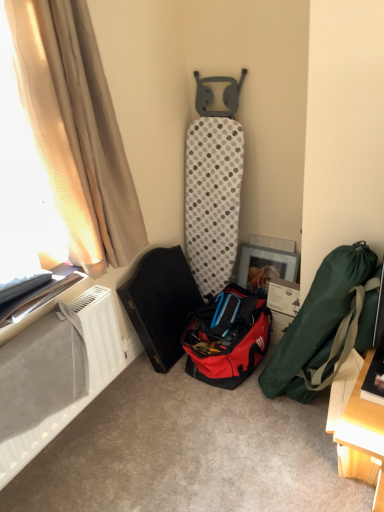
Question: From a real-world perspective, relative to white plastic radiator at lower left, is green fabric bag at right, which is the 2th luggage and bags from left to right, vertically above or below?

Choices:
 (A) below
 (B) above

Answer: (A)

Question: Is green fabric bag at right, the 1th luggage and bags when ordered from right to left, situated inside white plastic radiator at lower left or outside?

Choices:
 (A) inside
 (B) outside

Answer: (B)

Question: Considering the real-world distances, which object is closest to the beige fabric curtain at left?

Choices:
 (A) green fabric bag at right, the 1th luggage and bags when ordered from right to left
 (B) red fabric bag at center, the 1th luggage and bags in the left-to-right sequence
 (C) translucent beige curtain at left
 (D) white plastic radiator at lower left

Answer: (C)

Question: Considering the real-world distances, which object is farthest from the green fabric bag at right, the 1th luggage and bags when ordered from right to left?

Choices:
 (A) red fabric bag at center, the 1th luggage and bags in the left-to-right sequence
 (B) translucent beige curtain at left
 (C) beige fabric curtain at left
 (D) white plastic radiator at lower left

Answer: (B)